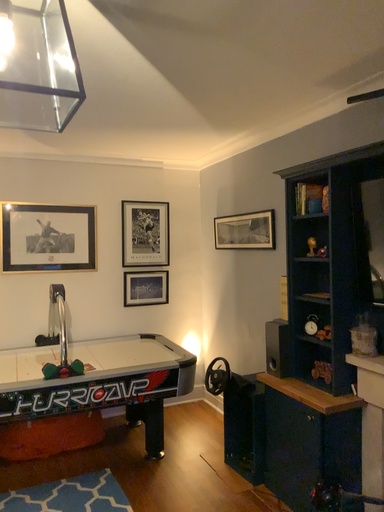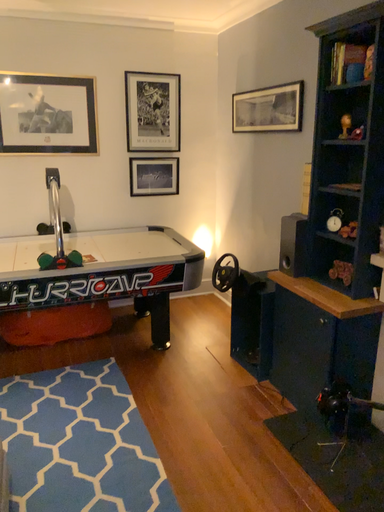
Question: Which way did the camera rotate in the video?

Choices:
 (A) rotated downward
 (B) rotated upward

Answer: (A)